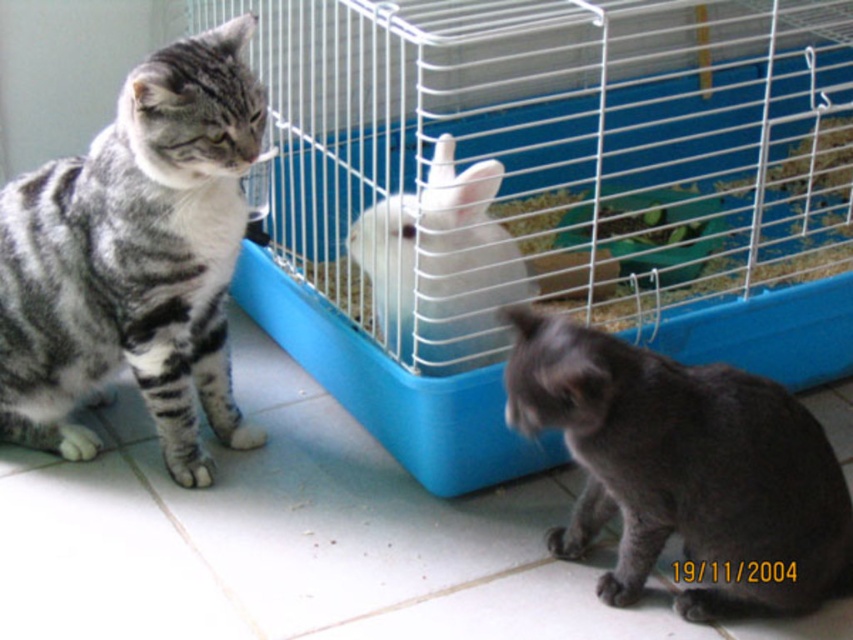
Is white wire bird cage at center wider than dark gray fur cat at lower right?

Correct, the width of white wire bird cage at center exceeds that of dark gray fur cat at lower right.

Does white wire bird cage at center appear on the left side of dark gray fur cat at lower right?

Incorrect, white wire bird cage at center is not on the left side of dark gray fur cat at lower right.

Locate an element on the screen. This screenshot has width=853, height=640. white wire bird cage at center is located at coordinates (547, 195).

Who is positioned more to the right, gray striped fur cat at left or white fluffy bunny at center?

white fluffy bunny at center

Does gray striped fur cat at left have a smaller size compared to white fluffy bunny at center?

Actually, gray striped fur cat at left might be larger than white fluffy bunny at center.

Where is `gray striped fur cat at left`? The width and height of the screenshot is (853, 640). gray striped fur cat at left is located at coordinates (135, 259).

Describe the element at coordinates (547, 195) in the screenshot. I see `white wire bird cage at center` at that location.

How much distance is there between white wire bird cage at center and white fluffy bunny at center?

The distance of white wire bird cage at center from white fluffy bunny at center is 9.67 inches.

This screenshot has width=853, height=640. I want to click on white wire bird cage at center, so click(x=547, y=195).